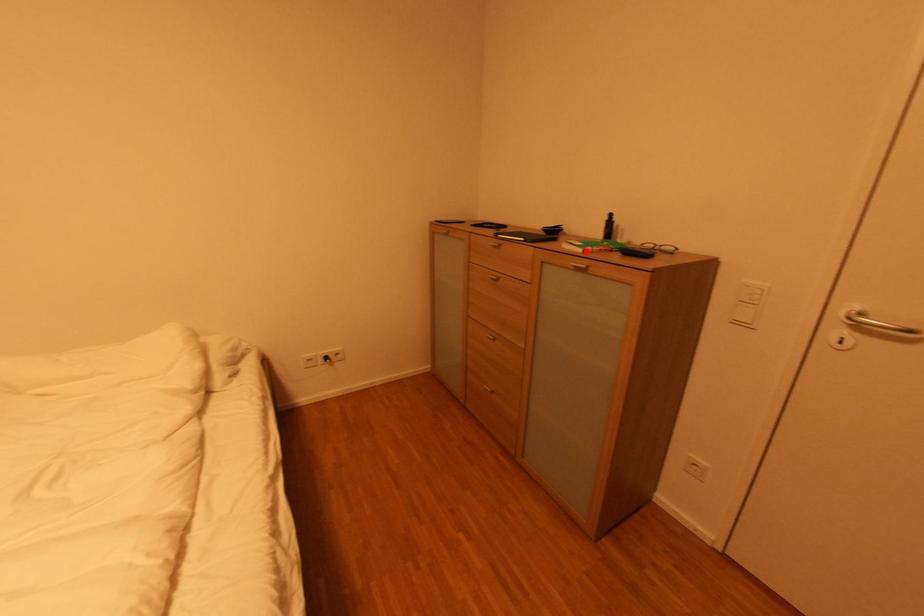
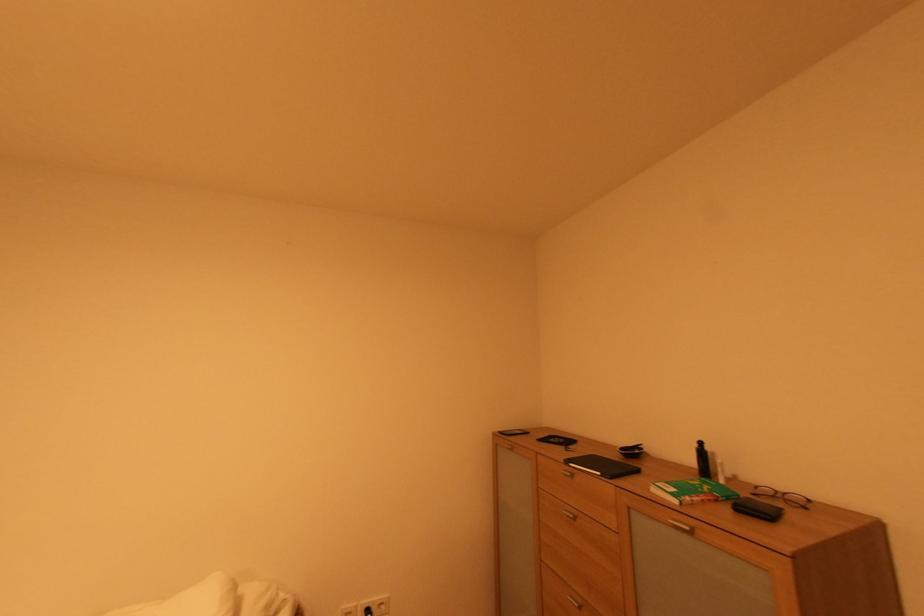
Where in the second image is the point corresponding to the highlighted location from the first image?

(682, 503)